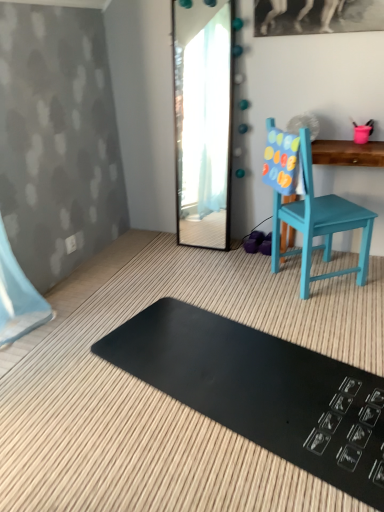
At what (x,y) coordinates should I click in order to perform the action: click on free spot in front of teal painted wood chair at right. Please return your answer as a coordinate pair (x, y). The image size is (384, 512). Looking at the image, I should click on (327, 314).